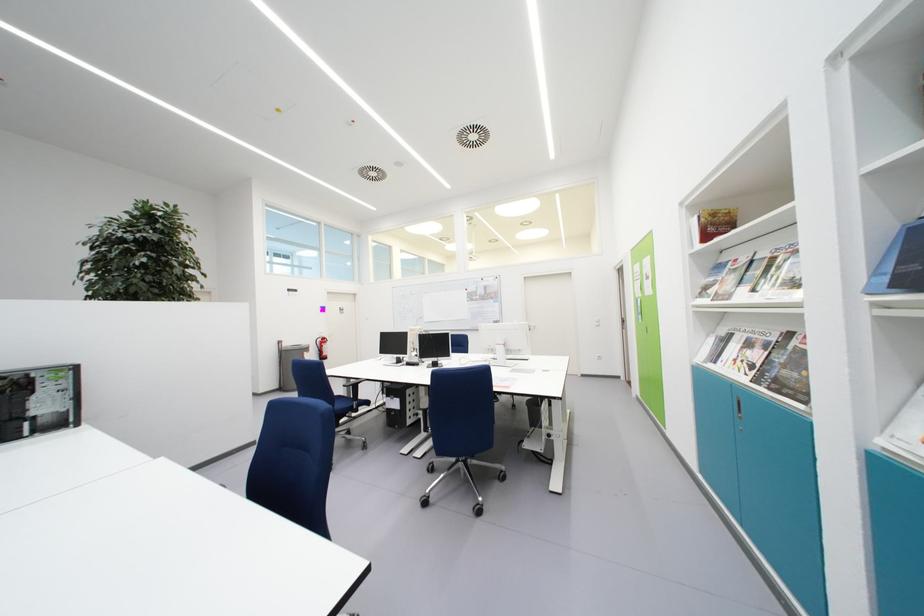
Find where to squeez the fire extinguisher handle. Please return your answer as a coordinate pair (x, y).

(319, 341)